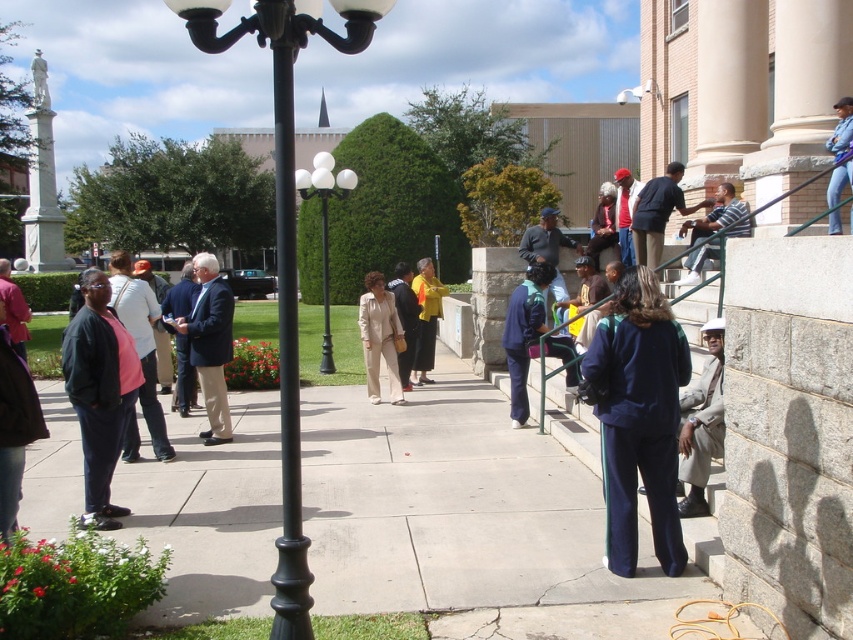
You are standing at the edge of the scene and want to pick up the light brown leather jacket at lower right and the blue fabric jacket at center. Which jacket will you reach first if you move directly toward the lamppost?

The light brown leather jacket at lower right is in front of the blue fabric jacket at center, so you will reach it first.

You are standing at the point labeled as point (285,243) in the image. What object are you touching?

The point labeled as point (285,243) is on the black metal lamp post at left, so you are touching the black metal lamp post at left.